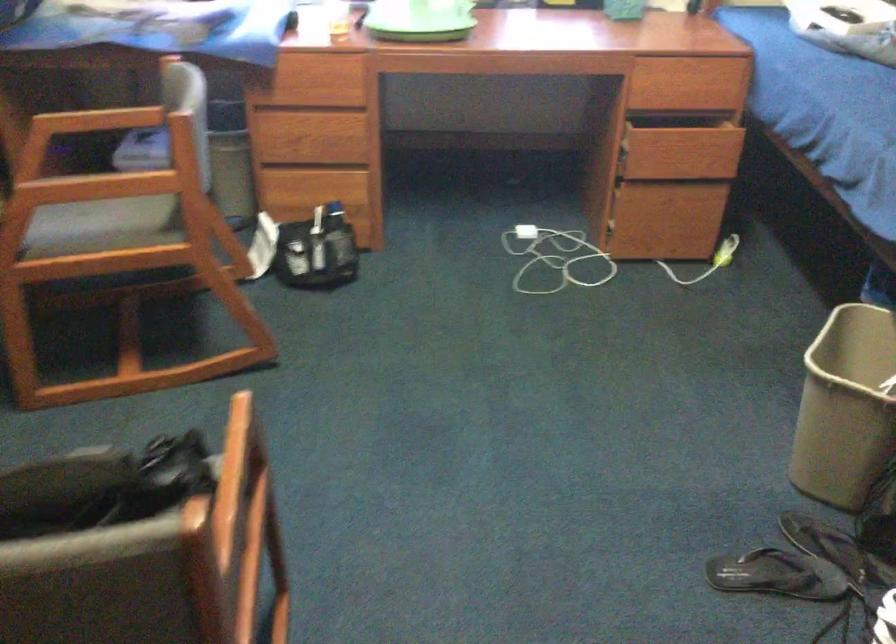
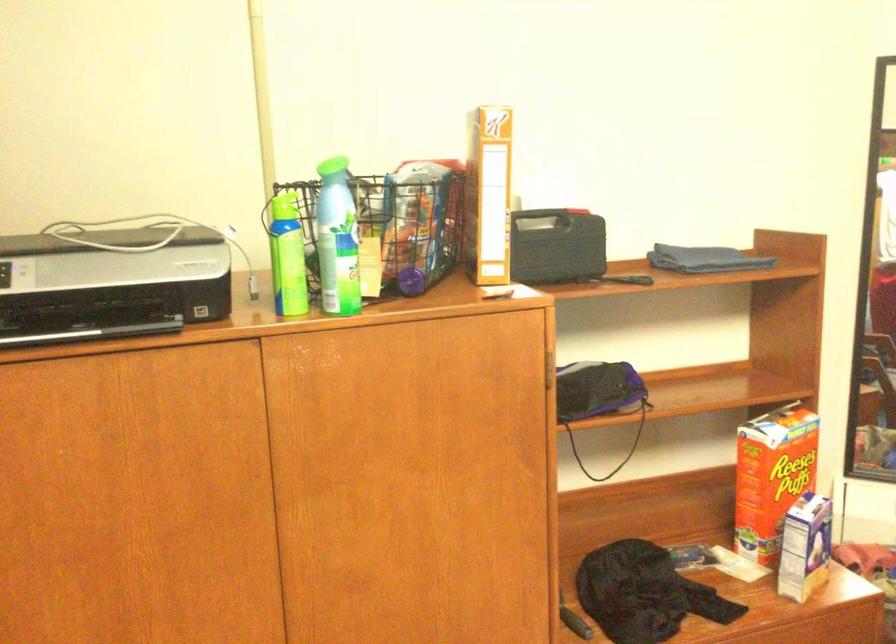
First-person continuous shooting, in which direction is the camera rotating?

The camera rotated toward left-down.